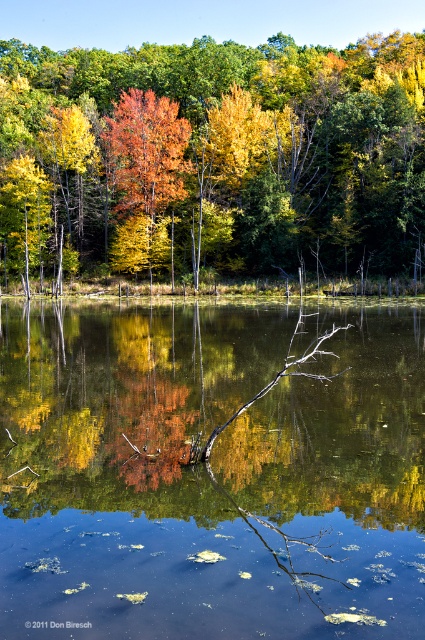
You are an artist planning to paint the autumn scene. You want to ensure the orange leafy tree at center and the shiny orange tree at center are proportionally accurate. Which tree should you paint larger?

The orange leafy tree at center should be painted larger since it has a larger size compared to the shiny orange tree at center according to the description.

You are an artist planning to paint the scene. You want to ensure that the green reflective water at center and the shiny orange tree at center are proportionally accurate. Which object should you paint first to maintain the correct size relationship between them?

You should paint the shiny orange tree at center first because the green reflective water at center is smaller in size compared to it, allowing you to establish the larger element before adjusting the smaller one accordingly.

You are an artist planning to paint the scene. You want to ensure the green reflective water at center and the orange leafy tree at center are proportionally accurate. Based on their positions in the image, which object should be drawn smaller in your painting?

The green reflective water at center should be drawn smaller because it has a lesser height compared to the orange leafy tree at center.